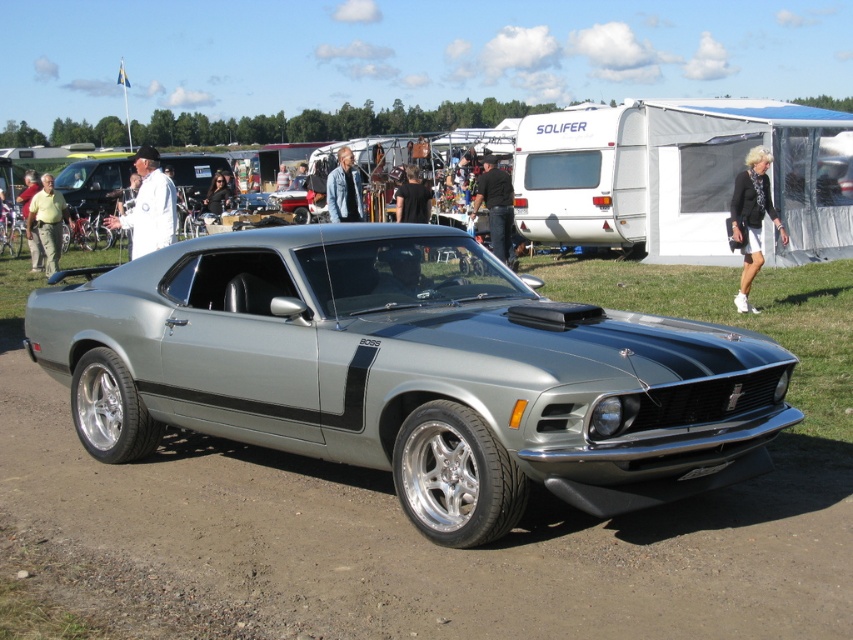
You are standing at the center of the scene and see the satin silver muscle car at center and the denim jacket at center. Which object is located to the right of the other?

The satin silver muscle car at center is positioned on the right side of denim jacket at center.

You are a photographer at the car show and want to capture a photo of the satin silver muscle car at center and the dark hair at center. Since you want both subjects to be in focus, you need to know which one is closer to the camera. Can you determine which is closer?

The satin silver muscle car at center is taller than dark hair at center, so the dark hair at center is closer to the camera.